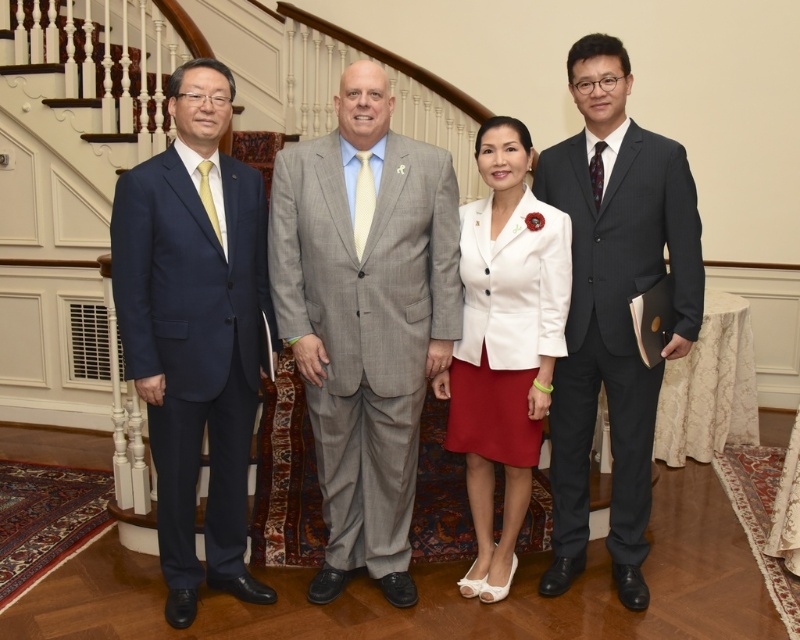
Is gray textured suit at center shorter than dark gray pinstripe suit at right?

Indeed, gray textured suit at center has a lesser height compared to dark gray pinstripe suit at right.

Can you confirm if gray textured suit at center is thinner than dark gray pinstripe suit at right?

In fact, gray textured suit at center might be wider than dark gray pinstripe suit at right.

Describe the element at coordinates (366, 317) in the screenshot. The width and height of the screenshot is (800, 640). I see `gray textured suit at center` at that location.

You are a GUI agent. You are given a task and a screenshot of the screen. Output one action in this format:
    pyautogui.click(x=<x>, y=<y>)
    Task: Click on the gray textured suit at center
    
    Given the screenshot: What is the action you would take?
    click(366, 317)

Who is more forward, (138, 376) or (558, 515)?

Point (138, 376) is more forward.

Does matte blue suit at left lie in front of dark gray pinstripe suit at right?

Yes, it is in front of dark gray pinstripe suit at right.

Is point (154, 333) closer to viewer compared to point (632, 218)?

Yes, it is in front of point (632, 218).

Locate an element on the screen. matte blue suit at left is located at coordinates (196, 330).

Is matte black suit at center to the left of white matte blazer at center from the viewer's perspective?

Correct, you'll find matte black suit at center to the left of white matte blazer at center.

How distant is matte black suit at center from white matte blazer at center?

matte black suit at center and white matte blazer at center are 15.03 centimeters apart.

Between point (558, 396) and point (506, 468), which one is positioned in front?

Point (506, 468) is in front.

Where is `matte black suit at center`? The image size is (800, 640). matte black suit at center is located at coordinates (649, 392).